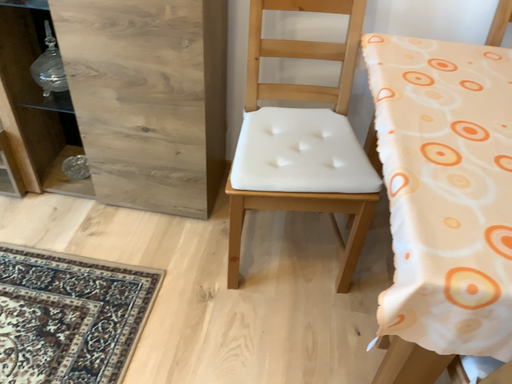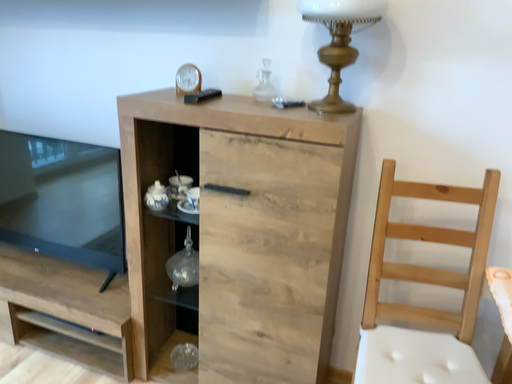
Question: Which way did the camera rotate in the video?

Choices:
 (A) rotated upward
 (B) rotated downward

Answer: (A)